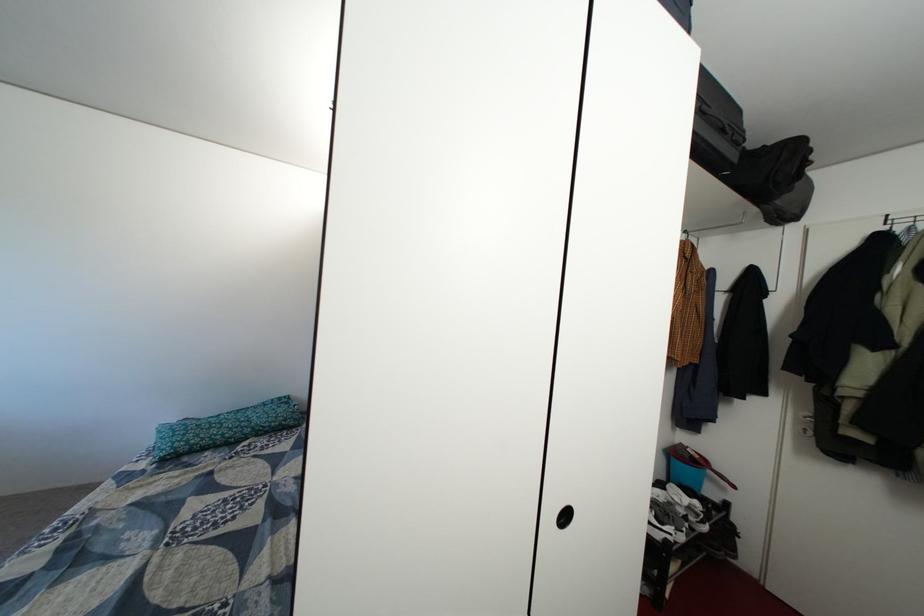
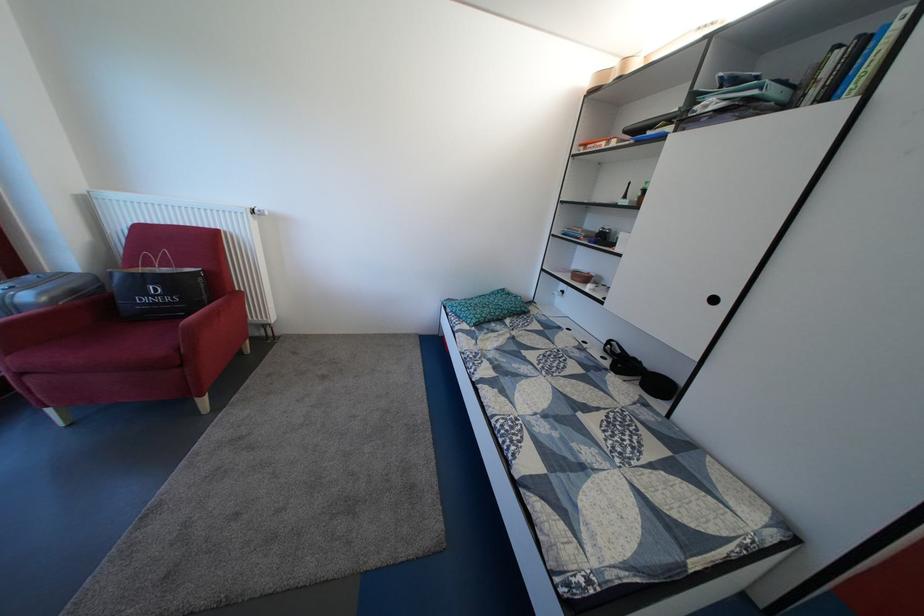
The point at (222, 435) is marked in the first image. Where is the corresponding point in the second image?

(494, 314)